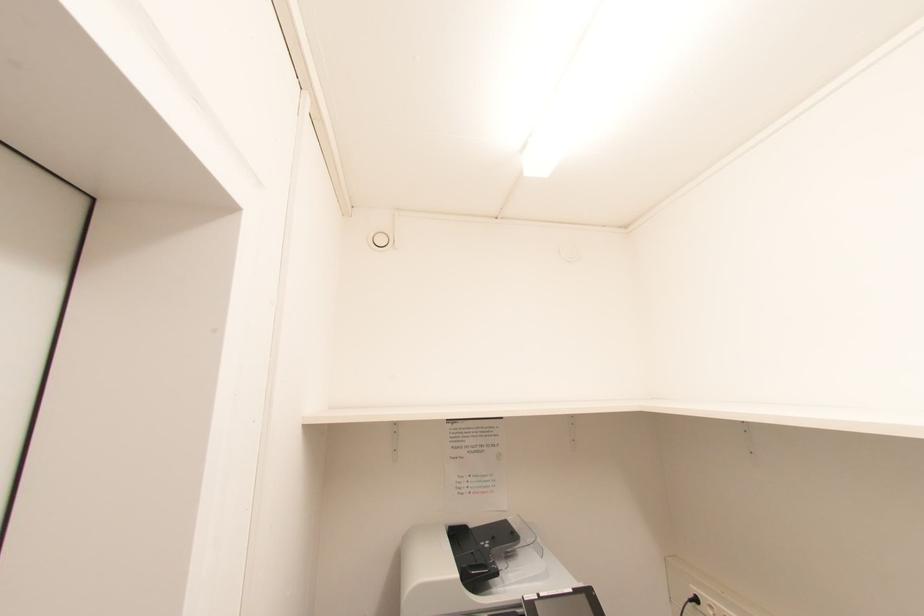
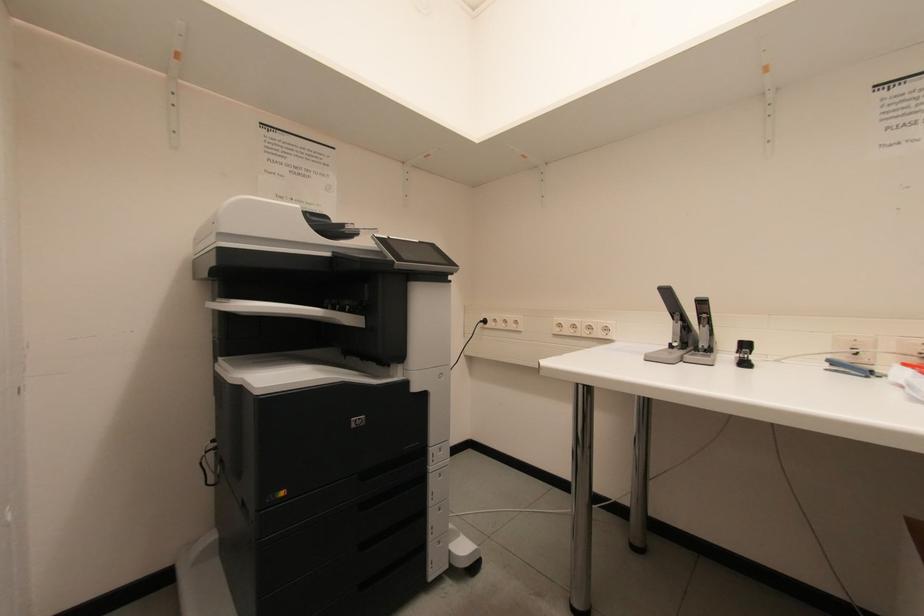
Question: How did the camera likely rotate?

Choices:
 (A) Left
 (B) Right
 (C) Up
 (D) Down

Answer: (B)